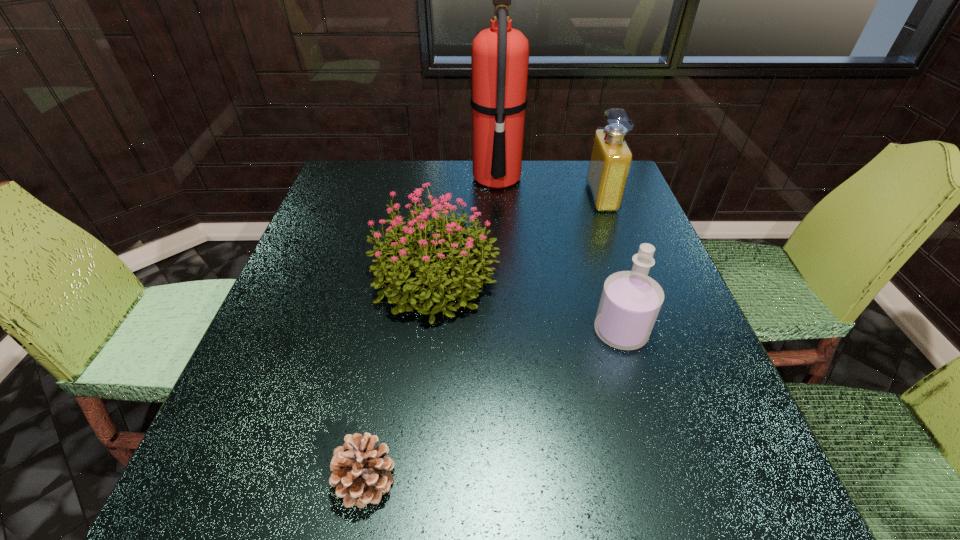
In the image, there is a desktop. Where is `vacant area at the left edge`? The width and height of the screenshot is (960, 540). vacant area at the left edge is located at coordinates (256, 350).

Image resolution: width=960 pixels, height=540 pixels. Find the location of `vacant space at the right edge of the desktop`. vacant space at the right edge of the desktop is located at coordinates (630, 231).

In the image, there is a desktop. Identify the location of vacant region at the far left corner. The height and width of the screenshot is (540, 960). (366, 200).

In the image, there is a desktop. Where is `vacant space at the near right corner`? This screenshot has height=540, width=960. vacant space at the near right corner is located at coordinates (668, 469).

Where is `free spot between the fire extinguisher and the farther perfume`? The width and height of the screenshot is (960, 540). free spot between the fire extinguisher and the farther perfume is located at coordinates (549, 188).

This screenshot has width=960, height=540. Find the location of `empty space that is in between the nearer perfume and the shortest object`. empty space that is in between the nearer perfume and the shortest object is located at coordinates pyautogui.click(x=493, y=406).

I want to click on unoccupied area between the nearer perfume and the bouquet, so click(528, 305).

Locate an element on the screen. This screenshot has height=540, width=960. vacant area that lies between the nearest object and the bouquet is located at coordinates (400, 379).

Find the location of a particular element. Image resolution: width=960 pixels, height=540 pixels. vacant space in between the farther perfume and the nearer perfume is located at coordinates (612, 265).

Where is `vacant space that is in between the nearer perfume and the tallest object`? vacant space that is in between the nearer perfume and the tallest object is located at coordinates pyautogui.click(x=559, y=255).